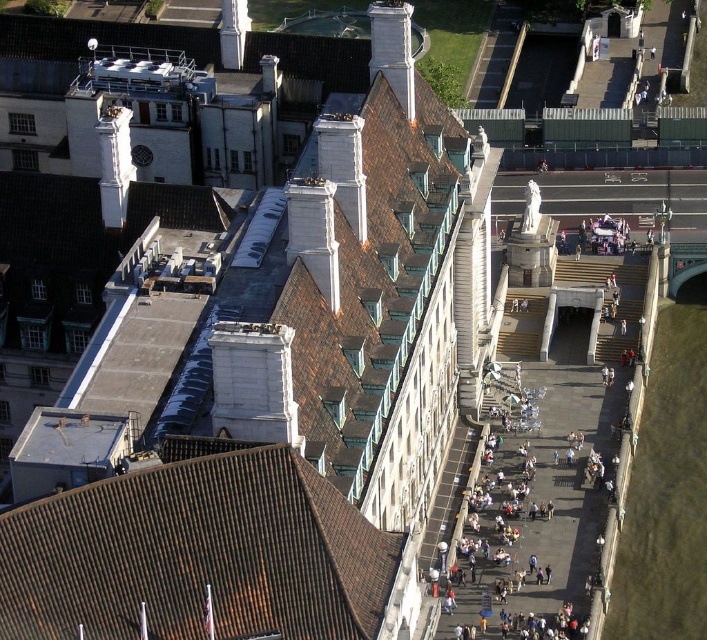
Is point (380, 579) closer to viewer compared to point (409, 74)?

That is True.

Between brown tile roof at lower left and white stone chimney at upper center, which one appears on the left side from the viewer's perspective?

brown tile roof at lower left

Find the location of a particular element. brown tile roof at lower left is located at coordinates (197, 552).

I want to click on brown tile roof at lower left, so click(197, 552).